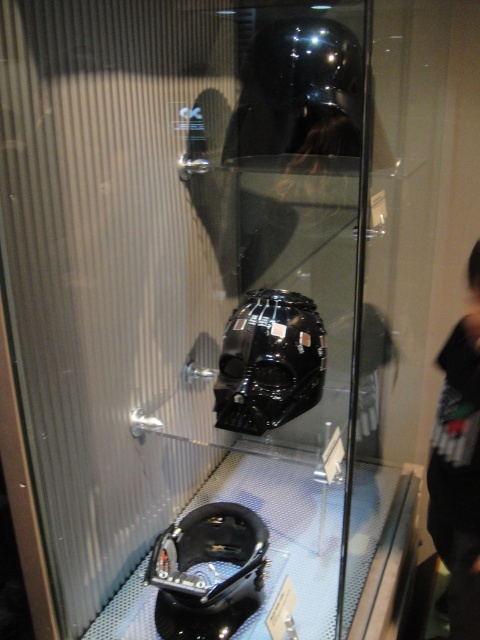
You are a museum curator checking the display case. You need to place a new label next to the glossy black helmet at center. Since the label is 10 cm wide, will it fit next to the helmet without overlapping the black matte helmet at lower center?

The glossy black helmet at center is narrower than the black matte helmet at lower center. Since the label is 10 cm wide, it should fit next to the glossy black helmet at center without overlapping the black matte helmet at lower center, provided there is sufficient space between them.

What is the color and position of the helmet at point (299, 92)?

The helmet at point (299, 92) is a glossy black helmet at upper center.

You are a museum curator checking the display case. You need to place a new label next to the glossy black helmet at center. Since the label is 10 cm wide, will it fit next to the helmet without overlapping the black matte helmet at lower center?

The glossy black helmet at center has a smaller size compared to the black matte helmet at lower center. Since the label is 10 cm wide, it may not fit without overlapping if the space between them is less than 10 cm. However, the exact distance isn